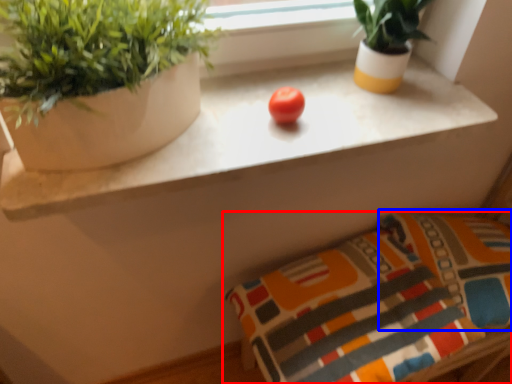
Question: Which object appears farthest to the camera in this image, pillow (highlighted by a red box) or pillow (highlighted by a blue box)?

Choices:
 (A) pillow
 (B) pillow

Answer: (B)